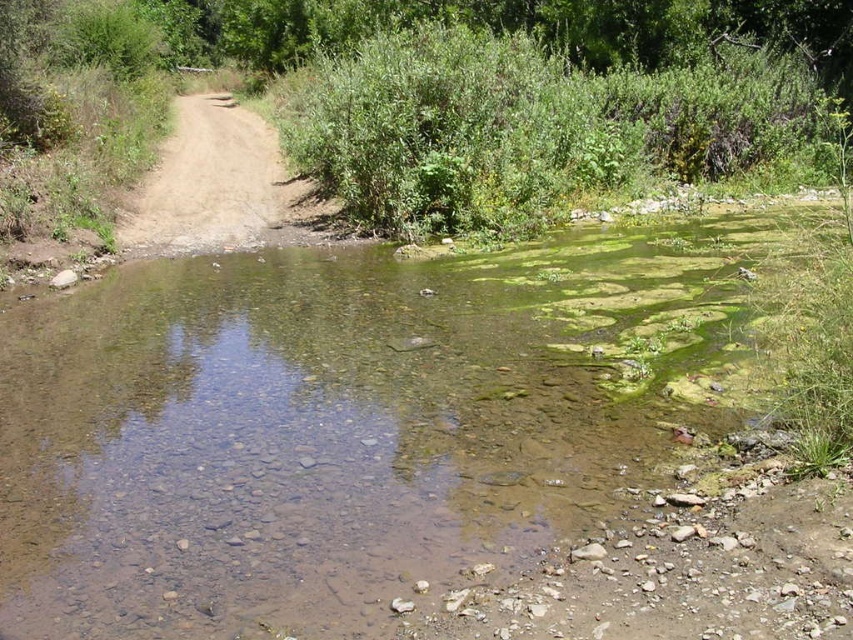
You are a hiker trying to cross the stream using the dirt road at center. You notice green mossy algae at upper right growing nearby. Considering their height, which one is higher?

The green mossy algae at upper right is much taller than the dirt road at center, so the green mossy algae at upper right is higher.

You are a hiker trying to cross the stream using the dirt road at center. You notice green mossy algae at upper right nearby. Which direction should you move to avoid stepping on the algae?

The green mossy algae at upper right is to the right of the dirt road at center, so you should move to the left to avoid stepping on it.